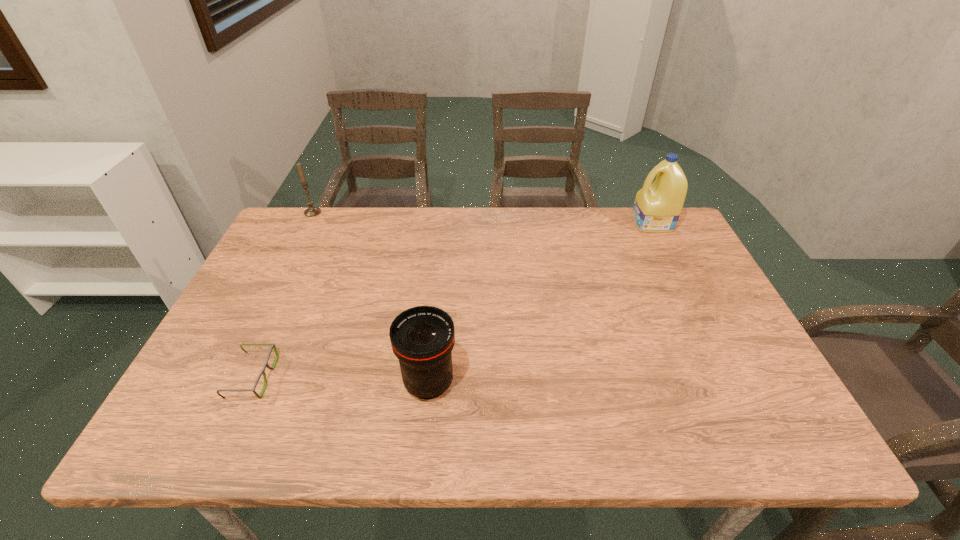
Where is `vacant space at the near edge of the desktop`? vacant space at the near edge of the desktop is located at coordinates (635, 424).

Find the location of a particular element. Image resolution: width=960 pixels, height=540 pixels. free space at the left edge of the desktop is located at coordinates (271, 319).

I want to click on vacant region at the right edge of the desktop, so click(x=711, y=379).

I want to click on vacant space at the far left corner, so click(x=289, y=241).

Where is `free region at the far right corner of the desktop`? The image size is (960, 540). free region at the far right corner of the desktop is located at coordinates (651, 245).

Locate an element on the screen. Image resolution: width=960 pixels, height=540 pixels. blank space at the near right corner of the desktop is located at coordinates (798, 446).

Where is `free space that is in between the second object from right to left and the rightmost object`? The width and height of the screenshot is (960, 540). free space that is in between the second object from right to left and the rightmost object is located at coordinates (540, 303).

Identify the location of unoccupied area between the candle and the spectacles. This screenshot has height=540, width=960. (282, 295).

Find the location of a particular element. free space between the second object from right to left and the tallest object is located at coordinates (540, 303).

Where is `free space between the telephoto lens and the candle`? Image resolution: width=960 pixels, height=540 pixels. free space between the telephoto lens and the candle is located at coordinates (371, 298).